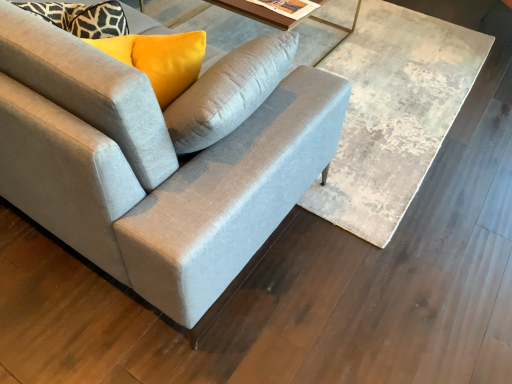
Question: Is wooden textured table at center not inside suede gray couch at center?

Choices:
 (A) yes
 (B) no

Answer: (A)

Question: Is wooden textured table at center surrounding suede gray couch at center?

Choices:
 (A) no
 (B) yes

Answer: (A)

Question: Does wooden textured table at center have a greater width compared to suede gray couch at center?

Choices:
 (A) no
 (B) yes

Answer: (B)

Question: Is wooden textured table at center at the right side of suede gray couch at center?

Choices:
 (A) no
 (B) yes

Answer: (B)

Question: From the image's perspective, is wooden textured table at center above suede gray couch at center?

Choices:
 (A) no
 (B) yes

Answer: (B)

Question: Relative to wooden textured table at center, is matte glass table at upper center in front or behind?

Choices:
 (A) front
 (B) behind

Answer: (B)

Question: From the image's perspective, is matte glass table at upper center above or below wooden textured table at center?

Choices:
 (A) above
 (B) below

Answer: (A)

Question: From a real-world perspective, is matte glass table at upper center above or below wooden textured table at center?

Choices:
 (A) above
 (B) below

Answer: (A)

Question: In terms of width, does matte glass table at upper center look wider or thinner when compared to wooden textured table at center?

Choices:
 (A) thin
 (B) wide

Answer: (A)

Question: In terms of size, does matte glass table at upper center appear bigger or smaller than suede gray couch at center?

Choices:
 (A) big
 (B) small

Answer: (B)

Question: Is point (175, 16) closer or farther from the camera than point (287, 112)?

Choices:
 (A) farther
 (B) closer

Answer: (A)

Question: Considering the positions of matte glass table at upper center and suede gray couch at center in the image, is matte glass table at upper center taller or shorter than suede gray couch at center?

Choices:
 (A) short
 (B) tall

Answer: (A)

Question: Choose the correct answer: Is matte glass table at upper center inside suede gray couch at center or outside it?

Choices:
 (A) outside
 (B) inside

Answer: (A)

Question: From their relative heights in the image, would you say suede gray couch at center is taller or shorter than matte glass table at upper center?

Choices:
 (A) short
 (B) tall

Answer: (B)

Question: Which is correct: suede gray couch at center is inside matte glass table at upper center, or outside of it?

Choices:
 (A) inside
 (B) outside

Answer: (B)